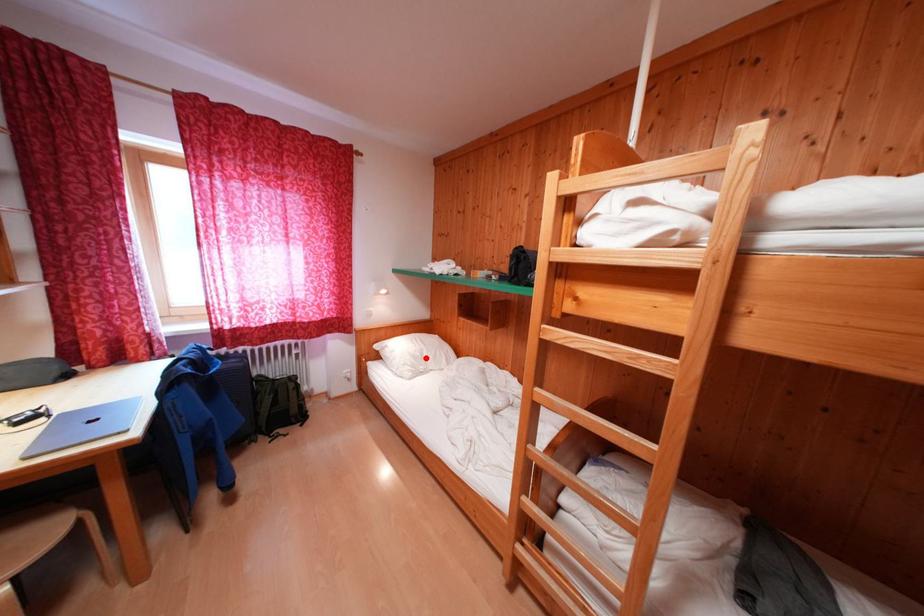
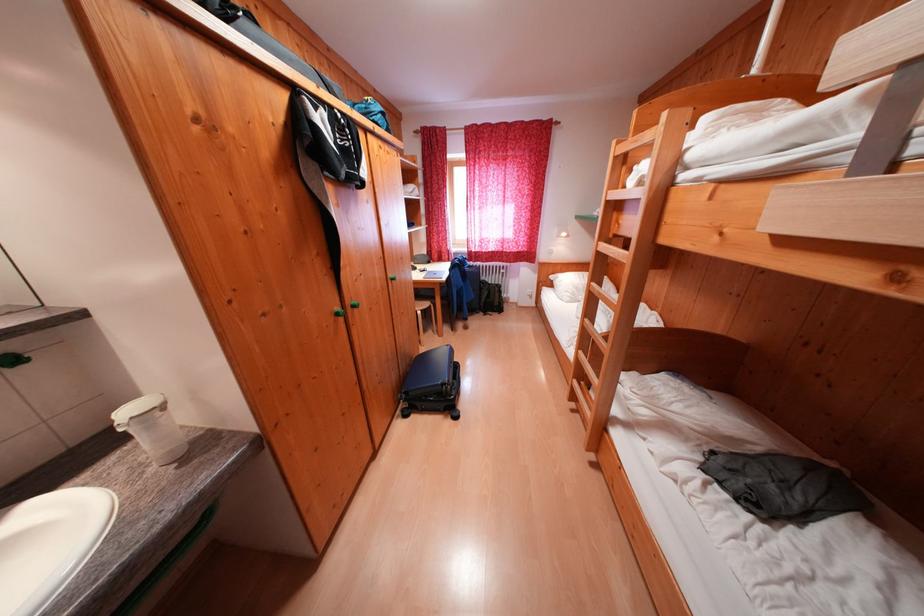
Locate, in the second image, the point that corresponds to the highlighted location in the first image.

(589, 291)